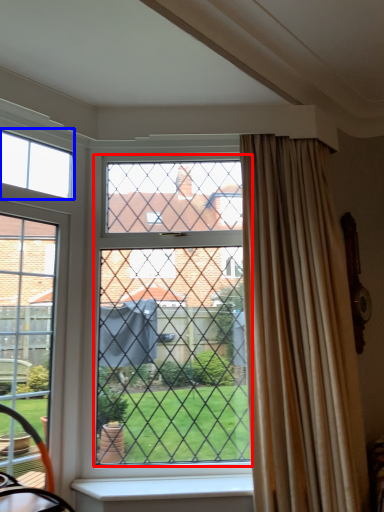
Question: Which object is further to the camera taking this photo, glass window (highlighted by a red box) or window (highlighted by a blue box)?

Choices:
 (A) glass window
 (B) window

Answer: (B)